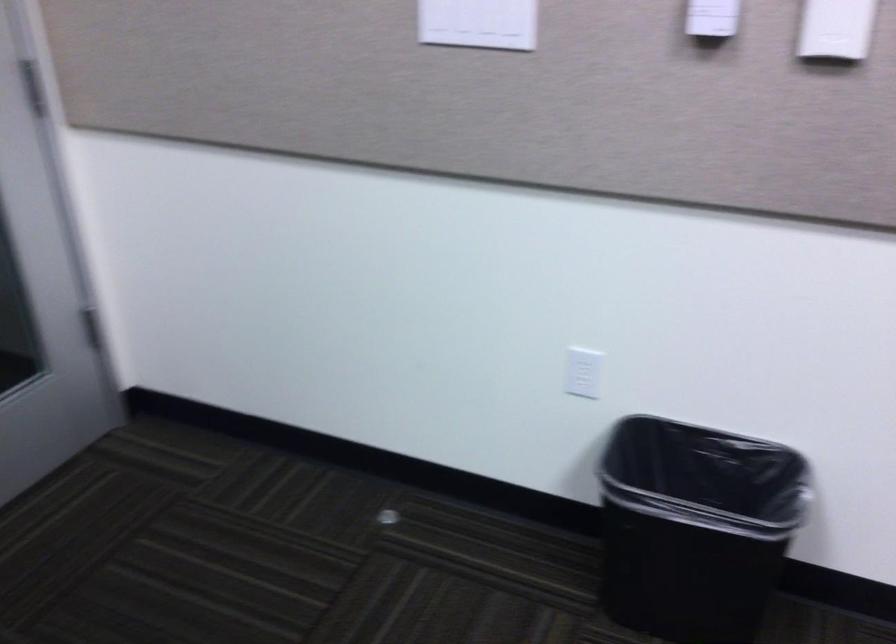
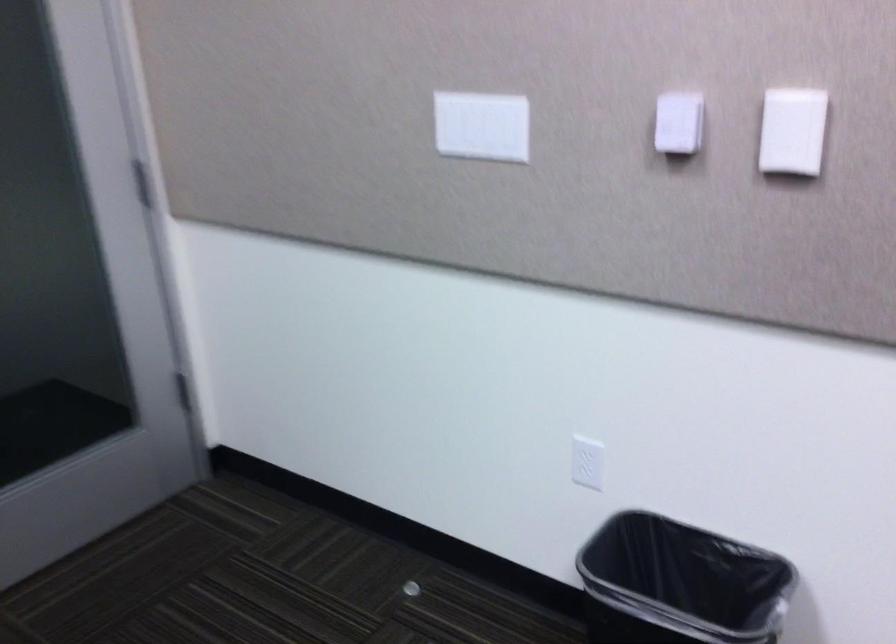
Question: The images are taken continuously from a first-person perspective. In which direction is your viewpoint rotating?

Choices:
 (A) Left
 (B) Right
 (C) Up
 (D) Down

Answer: (A)